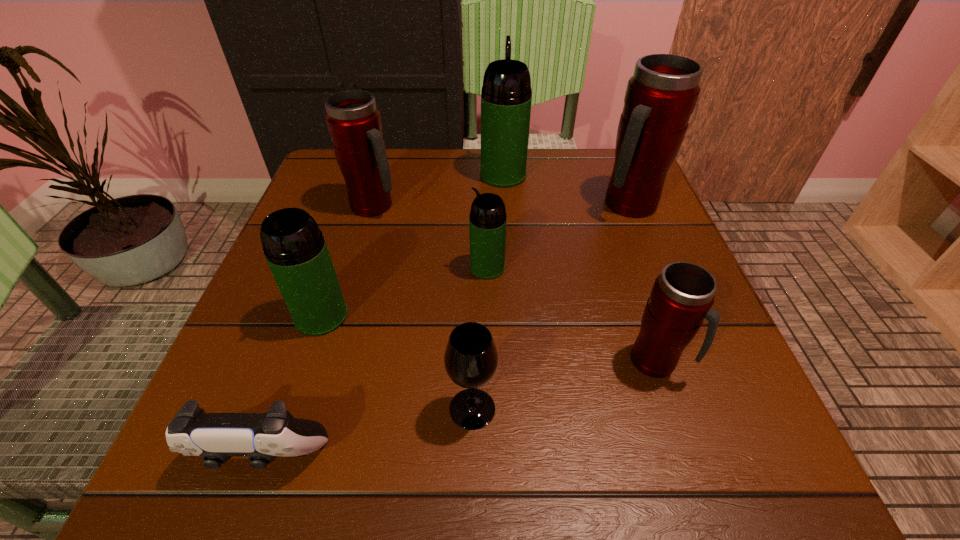
Select which thermos bottle appears as the second closest to the nearest green thermos bottle. Please provide its 2D coordinates. Your answer should be formatted as a tuple, i.e. [(x, y)], where the tuple contains the x and y coordinates of a point satisfying the conditions above.

[(354, 122)]

The width and height of the screenshot is (960, 540). Find the location of `green thermos bottle that is the closest to the nearest green thermos bottle`. green thermos bottle that is the closest to the nearest green thermos bottle is located at coordinates (487, 223).

Where is `the third closest green thermos bottle to the biggest red thermos bottle`? The height and width of the screenshot is (540, 960). the third closest green thermos bottle to the biggest red thermos bottle is located at coordinates (295, 249).

Locate which red thermos bottle ranks in proximity to the farthest green thermos bottle. Please provide its 2D coordinates. Your answer should be formatted as a tuple, i.e. [(x, y)], where the tuple contains the x and y coordinates of a point satisfying the conditions above.

[(660, 97)]

Identify the location of red thermos bottle that is the third closest to the nearest green thermos bottle. (660, 97).

I want to click on free space that satisfies the following two spatial constraints: 1. on the side with the handle of the nearest thermos bottle; 2. on the front-facing side of the shortest object, so [x=688, y=457].

Find the location of a particular element. The width and height of the screenshot is (960, 540). vacant region that satisfies the following two spatial constraints: 1. on the side with the handle of the second smallest red thermos bottle; 2. on the front-facing side of the nearest object is located at coordinates (302, 457).

Identify the location of free space that satisfies the following two spatial constraints: 1. on the side with the handle of the third nearest object; 2. on the front-facing side of the nearest object. This screenshot has width=960, height=540. (688, 457).

Find the location of `vacant space that satisfies the following two spatial constraints: 1. on the side with the handle of the second biggest red thermos bottle; 2. on the left side of the wineglass`. vacant space that satisfies the following two spatial constraints: 1. on the side with the handle of the second biggest red thermos bottle; 2. on the left side of the wineglass is located at coordinates click(316, 408).

Locate an element on the screen. Image resolution: width=960 pixels, height=540 pixels. free space that satisfies the following two spatial constraints: 1. from the spout of the third nearest thermos bottle; 2. on the front-facing side of the nearest object is located at coordinates (491, 457).